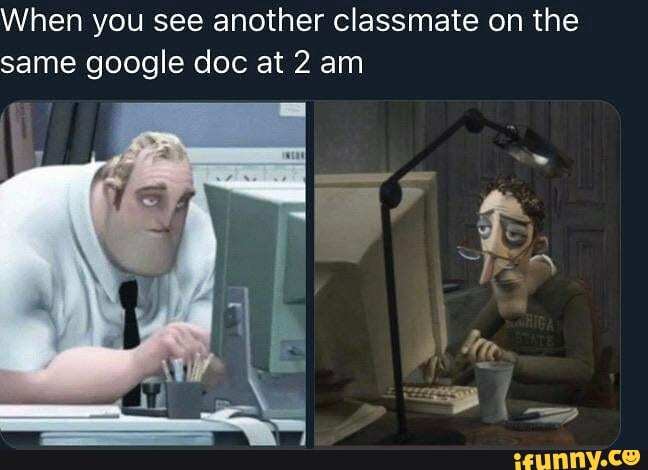
Where is `back of computer monitor`? This screenshot has height=470, width=648. back of computer monitor is located at coordinates (348, 236).